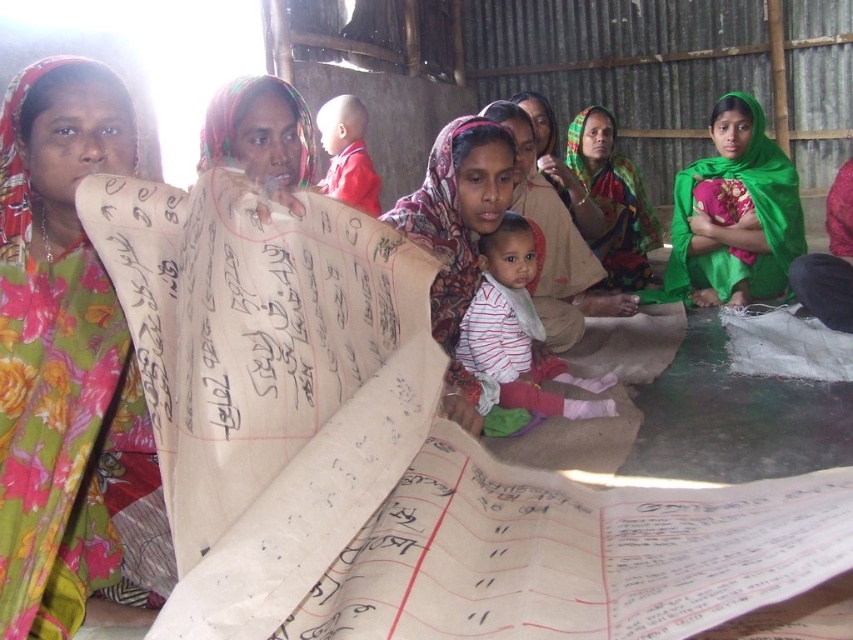
Based on the photo, which is more to the right, floral fabric scarf at upper left or striped fabric baby at center?

striped fabric baby at center

Which of these two, floral fabric scarf at upper left or striped fabric baby at center, stands taller?

Standing taller between the two is floral fabric scarf at upper left.

The width and height of the screenshot is (853, 640). Describe the element at coordinates (61, 353) in the screenshot. I see `floral fabric scarf at upper left` at that location.

This screenshot has height=640, width=853. What are the coordinates of `floral fabric scarf at upper left` in the screenshot? It's located at (61, 353).

Does beige paper scroll at center have a smaller size compared to multicolored fabric at center?

Indeed, beige paper scroll at center has a smaller size compared to multicolored fabric at center.

Identify the location of beige paper scroll at center. (392, 454).

Who is lower down, striped fabric baby at center or matte pink scarf at center?

striped fabric baby at center

Is striped fabric baby at center to the right of matte pink scarf at center from the viewer's perspective?

Yes, striped fabric baby at center is to the right of matte pink scarf at center.

The height and width of the screenshot is (640, 853). In order to click on striped fabric baby at center in this screenshot , I will do `click(517, 332)`.